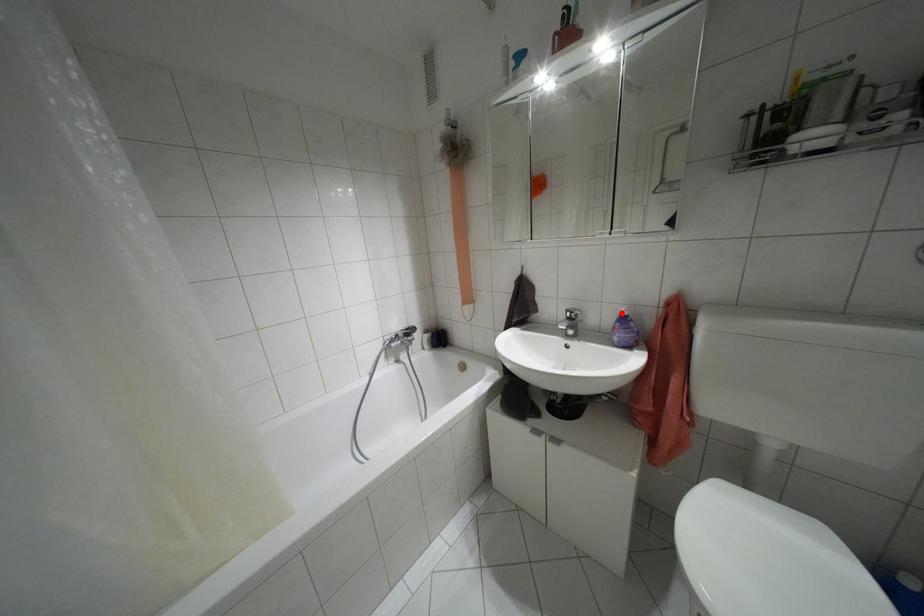
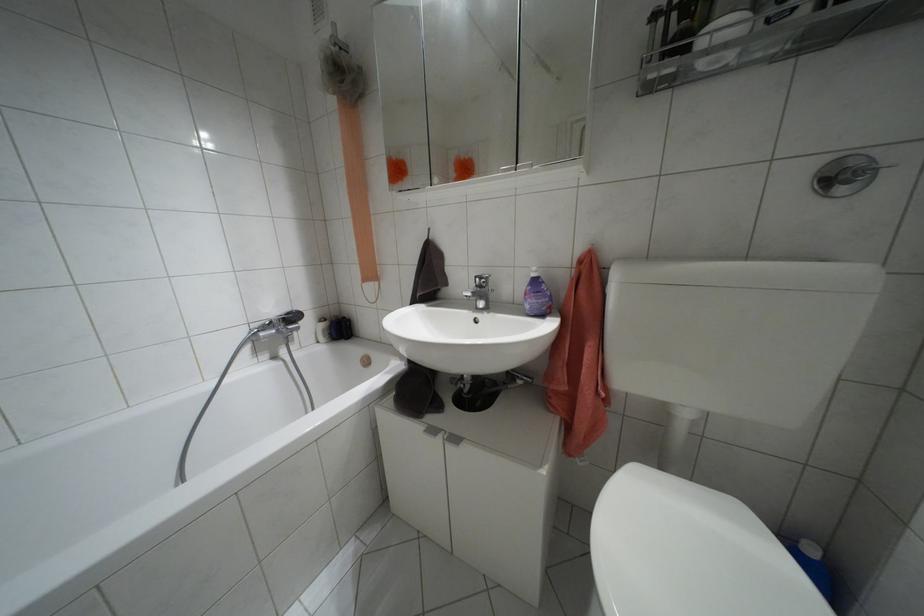
The point at the highlighted location is marked in the first image. Where is the corresponding point in the second image?

(532, 274)